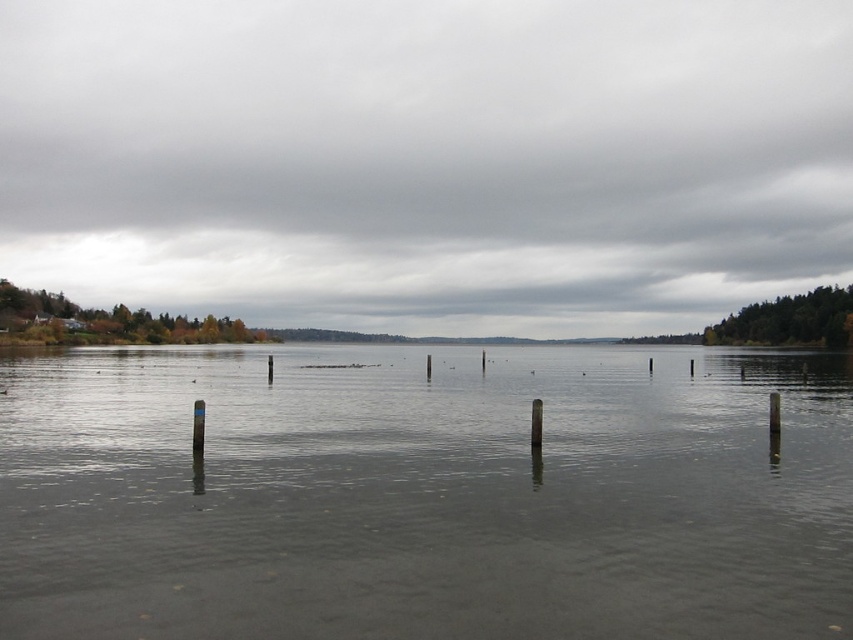
Is gray cloudy sky at upper center positioned behind black wood pole at center-right?

Yes, it is behind black wood pole at center-right.

Between point (558, 124) and point (779, 432), which one is positioned behind?

The point (558, 124) is more distant.

The image size is (853, 640). What are the coordinates of `gray cloudy sky at upper center` in the screenshot? It's located at (428, 160).

Is gray cloudy sky at upper center further to the viewer compared to gray matte water at center?

Yes.

Does gray cloudy sky at upper center have a greater height compared to gray matte water at center?

Yes, gray cloudy sky at upper center is taller than gray matte water at center.

Is point (395, 138) farther from viewer compared to point (718, 598)?

Yes, it is.

Where is `gray cloudy sky at upper center`? The image size is (853, 640). gray cloudy sky at upper center is located at coordinates (428, 160).

Between smooth wood post at center and black wood pole at center-right, which one has less height?

Standing shorter between the two is smooth wood post at center.

Between point (531, 412) and point (772, 417), which one is positioned in front?

Point (772, 417) is more forward.

Find the location of a particular element. smooth wood post at center is located at coordinates (537, 422).